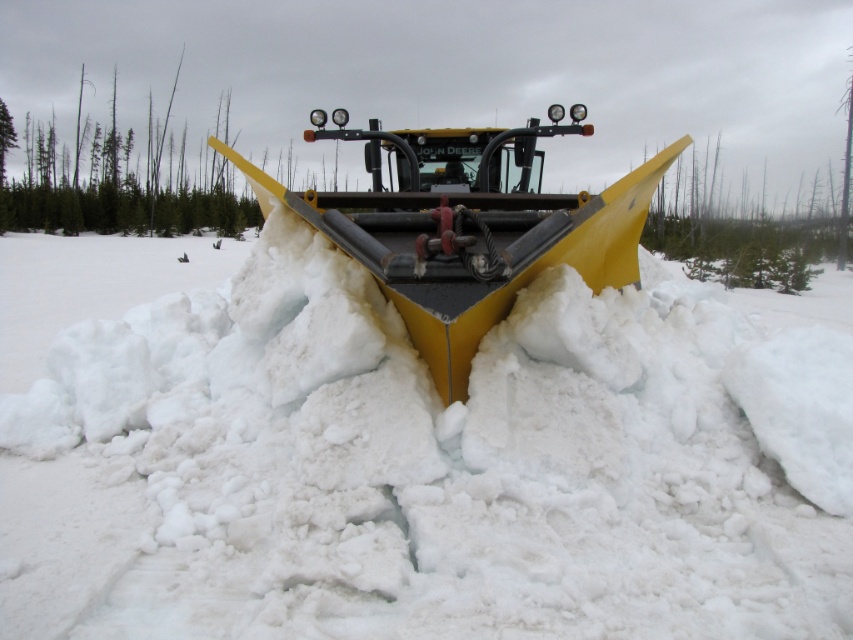
Is point (294, 390) closer to camera compared to point (321, 221)?

No, it is behind (321, 221).

Identify the location of white fluffy snow at center. (408, 456).

Identify the location of white fluffy snow at center. coord(408,456).